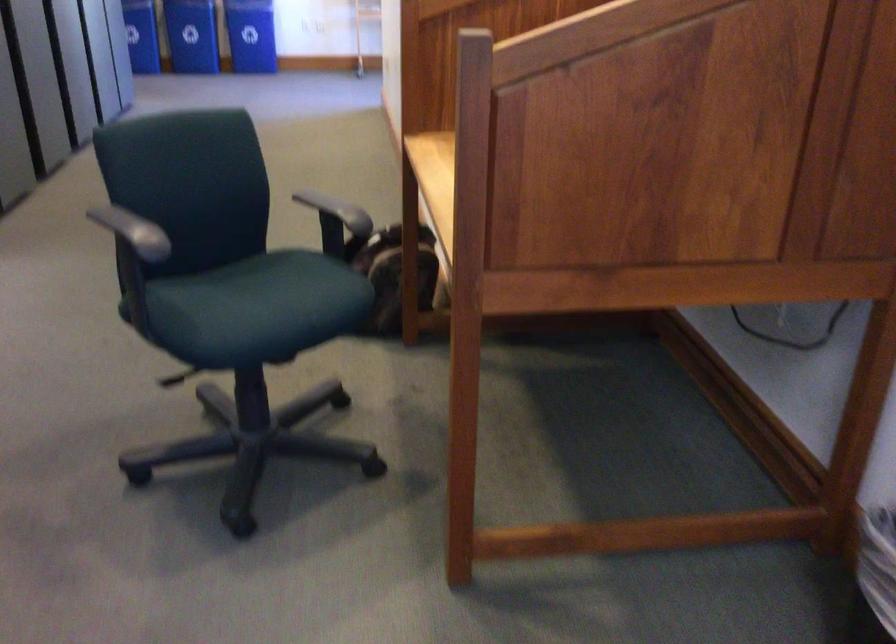
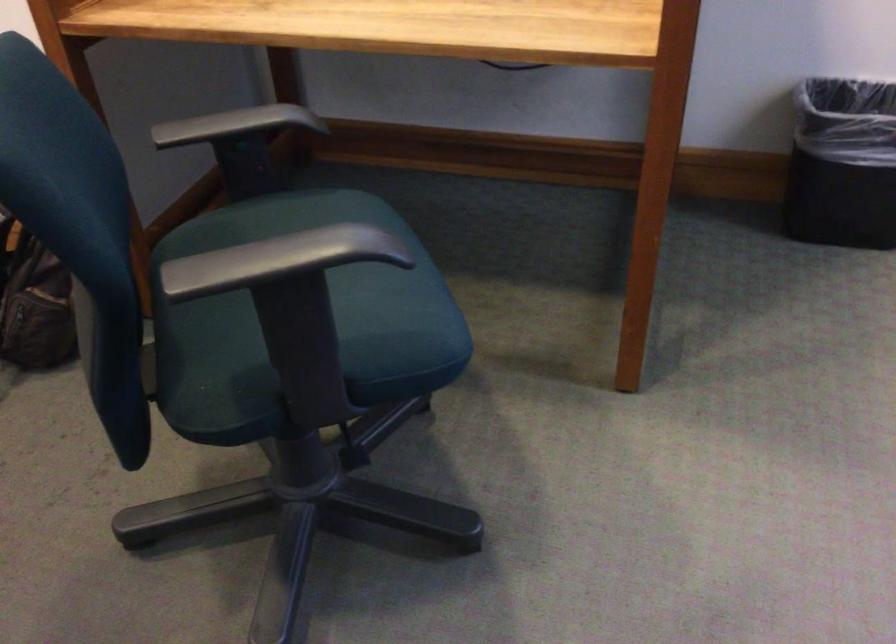
In the second image, find the point that corresponds to pixel 108 225 in the first image.

(250, 265)